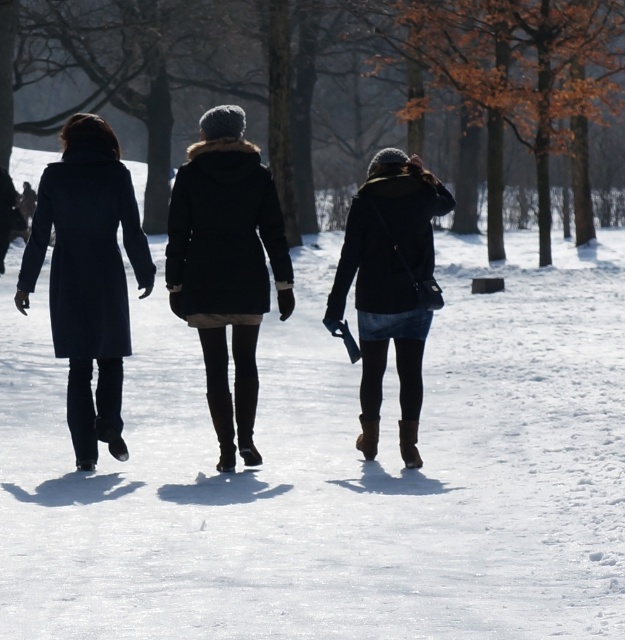
Which of these two, matte black coat at center or matte black coat at left, stands taller?

With more height is matte black coat at left.

Between matte black coat at center and matte black coat at left, which one is positioned lower?

Positioned lower is matte black coat at center.

Does point (196, 209) lie in front of point (61, 240)?

Yes, point (196, 209) is closer to viewer.

At what (x,y) coordinates should I click in order to perform the action: click on matte black coat at center. Please return your answer as a coordinate pair (x, y). Looking at the image, I should click on (226, 266).

Is matte black coat at center positioned at the back of matte black jacket at center?

No.

Between point (272, 212) and point (371, 257), which one is positioned behind?

The point (371, 257) is more distant.

I want to click on matte black coat at center, so click(226, 266).

Is matte black coat at left bigger than matte black jacket at center?

Indeed, matte black coat at left has a larger size compared to matte black jacket at center.

Is matte black coat at left wider than matte black jacket at center?

Correct, the width of matte black coat at left exceeds that of matte black jacket at center.

The width and height of the screenshot is (625, 640). What are the coordinates of `matte black coat at left` in the screenshot? It's located at (x=88, y=276).